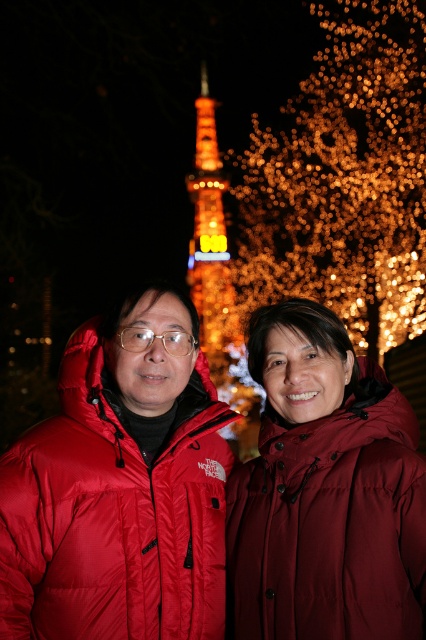
In the scene shown: You are a photographer aiming to capture a photo of the burgundy matte jacket at center and the illuminated glass tower at center. From your current position, which object should you adjust your camera to focus on first if you want to include both in the frame without moving your position?

The burgundy matte jacket at center is positioned on the right side of the illuminated glass tower at center, so you should focus on the illuminated glass tower at center first to ensure both are in the frame.

You are a photographer trying to capture both the burgundy matte jacket at center and the matte red puffer jacket at center in a single frame. Given their sizes, which jacket will appear smaller in the photo?

The burgundy matte jacket at center will appear smaller in the photo because it occupies less space than the matte red puffer jacket at center.

You are planning to take a photo of the illuminated golden lights at upper center and the illuminated glass tower at center. Which object should you focus on first if you want to capture both in the same frame without moving the camera?

You should focus on the illuminated glass tower at center first because it is taller than the illuminated golden lights at upper center, so it will occupy more space in the frame and help ensure both are included.